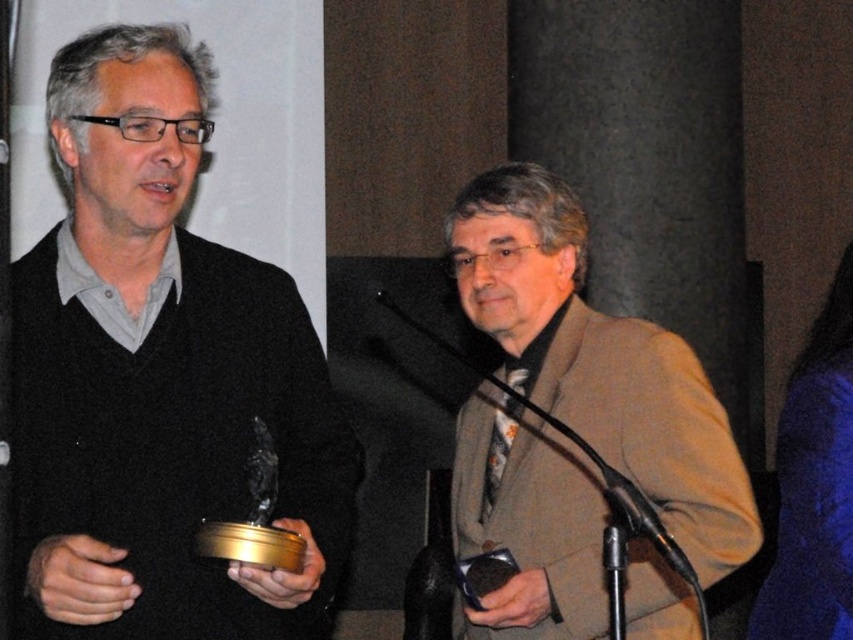
Question: Which point is closer to the camera taking this photo?

Choices:
 (A) (252, 314)
 (B) (552, 540)
 (C) (778, 460)

Answer: (A)

Question: Is blue fuzzy sweater at right to the left of black metallic microphone at center from the viewer's perspective?

Choices:
 (A) no
 (B) yes

Answer: (A)

Question: Does matte black sweater at left appear on the right side of blue fuzzy sweater at right?

Choices:
 (A) yes
 (B) no

Answer: (B)

Question: Which object is the farthest from the black metallic microphone at center?

Choices:
 (A) blue fuzzy sweater at right
 (B) matte black sweater at left

Answer: (A)

Question: Which of the following is the farthest from the observer?

Choices:
 (A) (59, 560)
 (B) (625, 497)

Answer: (B)

Question: Is matte black sweater at left wider than blue fuzzy sweater at right?

Choices:
 (A) yes
 (B) no

Answer: (A)